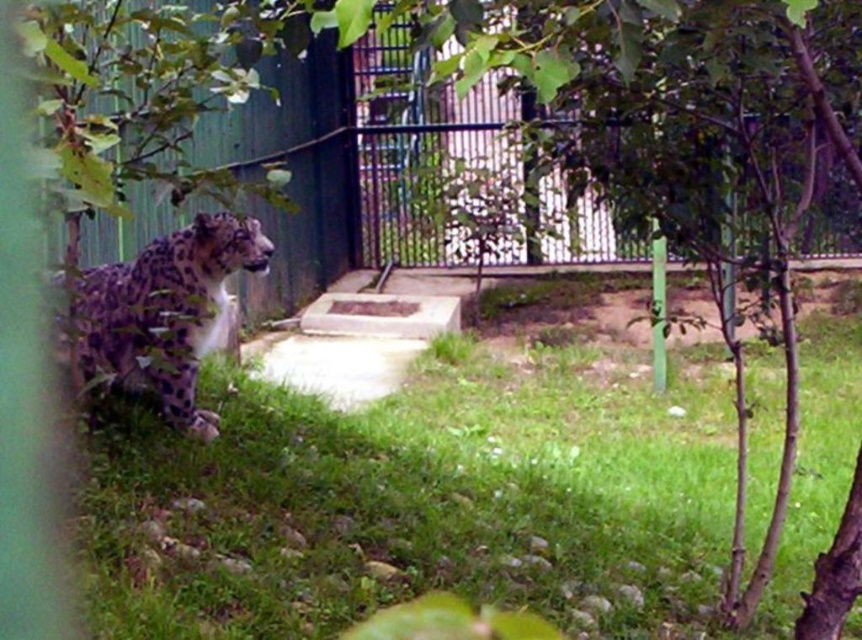
Which is behind, point (448, 76) or point (108, 292)?

Point (108, 292)

This screenshot has width=862, height=640. Describe the element at coordinates (671, 100) in the screenshot. I see `metallic gate at center` at that location.

Where is `metallic gate at center`? The width and height of the screenshot is (862, 640). metallic gate at center is located at coordinates (671, 100).

The width and height of the screenshot is (862, 640). Identify the location of metallic gate at center. (671, 100).

The image size is (862, 640). What do you see at coordinates (417, 502) in the screenshot?
I see `green grass at lower center` at bounding box center [417, 502].

Does point (325, 492) come behind point (116, 273)?

No, (325, 492) is closer to viewer.

Who is more forward, (161, 460) or (136, 268)?

Point (161, 460) is more forward.

At what (x,y) coordinates should I click in order to perform the action: click on green grass at lower center. Please return your answer as a coordinate pair (x, y). Looking at the image, I should click on (417, 502).

Can you confirm if green leafy tree at center is positioned above spotted fur leopard at left?

Yes, green leafy tree at center is above spotted fur leopard at left.

Can you confirm if green leafy tree at center is thinner than spotted fur leopard at left?

No, green leafy tree at center is not thinner than spotted fur leopard at left.

What do you see at coordinates (689, 141) in the screenshot? Image resolution: width=862 pixels, height=640 pixels. I see `green leafy tree at center` at bounding box center [689, 141].

The height and width of the screenshot is (640, 862). In order to click on green leafy tree at center in this screenshot , I will do `click(689, 141)`.